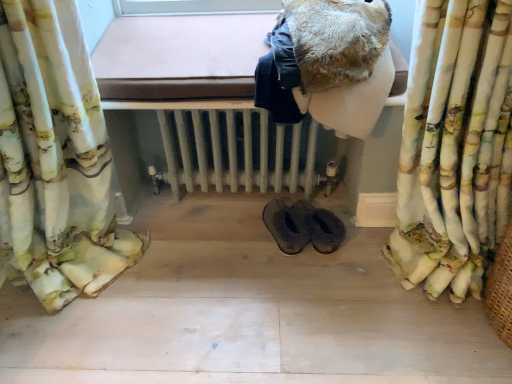
Question: Is black leather slippers at center to the right of fuzzy brown blanket at upper center from the viewer's perspective?

Choices:
 (A) no
 (B) yes

Answer: (A)

Question: Is black leather slippers at center in contact with fuzzy brown blanket at upper center?

Choices:
 (A) yes
 (B) no

Answer: (B)

Question: Can you confirm if black leather slippers at center is positioned to the left of fuzzy brown blanket at upper center?

Choices:
 (A) yes
 (B) no

Answer: (A)

Question: Is black leather slippers at center bigger than fuzzy brown blanket at upper center?

Choices:
 (A) no
 (B) yes

Answer: (A)

Question: Considering the relative sizes of black leather slippers at center and fuzzy brown blanket at upper center in the image provided, is black leather slippers at center taller than fuzzy brown blanket at upper center?

Choices:
 (A) no
 (B) yes

Answer: (A)

Question: In terms of height, does fuzzy brown blanket at upper center look taller or shorter compared to white painted radiator at center?

Choices:
 (A) short
 (B) tall

Answer: (A)

Question: In terms of width, does fuzzy brown blanket at upper center look wider or thinner when compared to white painted radiator at center?

Choices:
 (A) thin
 (B) wide

Answer: (A)

Question: From a real-world perspective, is fuzzy brown blanket at upper center positioned above or below white painted radiator at center?

Choices:
 (A) below
 (B) above

Answer: (B)

Question: Is fuzzy brown blanket at upper center inside or outside of white painted radiator at center?

Choices:
 (A) outside
 (B) inside

Answer: (A)

Question: Would you say fluffy fabric curtain at right is inside or outside fuzzy brown blanket at upper center?

Choices:
 (A) outside
 (B) inside

Answer: (A)

Question: Relative to fuzzy brown blanket at upper center, is fluffy fabric curtain at right in front or behind?

Choices:
 (A) front
 (B) behind

Answer: (A)

Question: Visually, is fluffy fabric curtain at right positioned to the left or to the right of fuzzy brown blanket at upper center?

Choices:
 (A) left
 (B) right

Answer: (B)

Question: In terms of height, does fluffy fabric curtain at right look taller or shorter compared to fuzzy brown blanket at upper center?

Choices:
 (A) short
 (B) tall

Answer: (B)

Question: Considering the positions of fluffy fabric curtain at right and white painted radiator at center in the image, is fluffy fabric curtain at right bigger or smaller than white painted radiator at center?

Choices:
 (A) big
 (B) small

Answer: (A)

Question: Choose the correct answer: Is fluffy fabric curtain at right inside white painted radiator at center or outside it?

Choices:
 (A) inside
 (B) outside

Answer: (B)